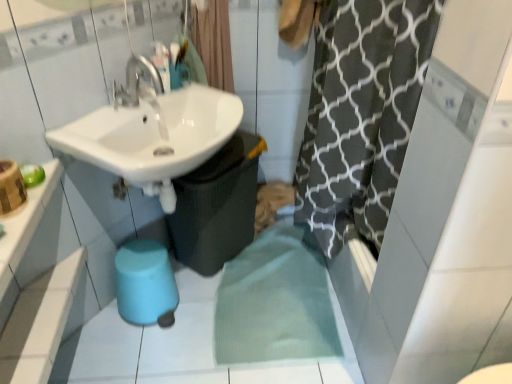
Question: Does black textured shower curtain at upper center have a lesser height compared to white glossy counter top at upper left?

Choices:
 (A) no
 (B) yes

Answer: (A)

Question: Is black textured shower curtain at upper center to the left of white glossy counter top at upper left from the viewer's perspective?

Choices:
 (A) yes
 (B) no

Answer: (B)

Question: Does black textured shower curtain at upper center have a larger size compared to white glossy counter top at upper left?

Choices:
 (A) no
 (B) yes

Answer: (B)

Question: Is black textured shower curtain at upper center positioned before white glossy counter top at upper left?

Choices:
 (A) yes
 (B) no

Answer: (B)

Question: From a real-world perspective, is black textured shower curtain at upper center located higher than white glossy counter top at upper left?

Choices:
 (A) yes
 (B) no

Answer: (A)

Question: In terms of height, does white glossy sink at upper left look taller or shorter compared to white glossy counter top at upper left?

Choices:
 (A) tall
 (B) short

Answer: (A)

Question: Is point (208, 110) positioned closer to the camera than point (55, 183)?

Choices:
 (A) farther
 (B) closer

Answer: (A)

Question: Considering the positions of white glossy sink at upper left and white glossy counter top at upper left in the image, is white glossy sink at upper left wider or thinner than white glossy counter top at upper left?

Choices:
 (A) wide
 (B) thin

Answer: (A)

Question: Considering the relative positions of white glossy sink at upper left and white glossy counter top at upper left in the image provided, is white glossy sink at upper left to the left or to the right of white glossy counter top at upper left?

Choices:
 (A) right
 (B) left

Answer: (A)

Question: Is blue rubber bidet at lower center spatially inside white glossy sink at upper left, or outside of it?

Choices:
 (A) inside
 (B) outside

Answer: (B)

Question: Is blue rubber bidet at lower center to the left or to the right of white glossy sink at upper left in the image?

Choices:
 (A) left
 (B) right

Answer: (A)

Question: Looking at their shapes, would you say blue rubber bidet at lower center is wider or thinner than white glossy sink at upper left?

Choices:
 (A) wide
 (B) thin

Answer: (B)

Question: From their relative heights in the image, would you say blue rubber bidet at lower center is taller or shorter than white glossy sink at upper left?

Choices:
 (A) tall
 (B) short

Answer: (B)

Question: Considering their positions, is blue rubber bidet at lower center located in front of or behind black textured shower curtain at upper center?

Choices:
 (A) front
 (B) behind

Answer: (A)

Question: From the image's perspective, is blue rubber bidet at lower center positioned above or below black textured shower curtain at upper center?

Choices:
 (A) below
 (B) above

Answer: (A)